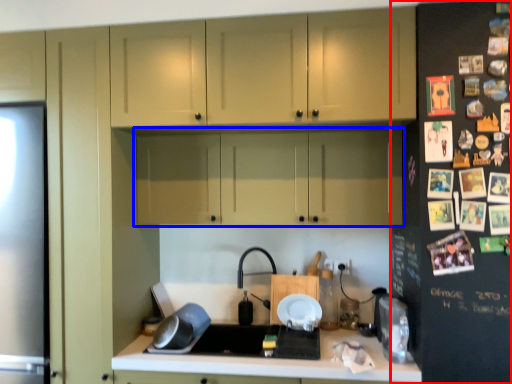
Question: Which object appears farthest to the camera in this image, fridge (highlighted by a red box) or cabinetry (highlighted by a blue box)?

Choices:
 (A) fridge
 (B) cabinetry

Answer: (B)